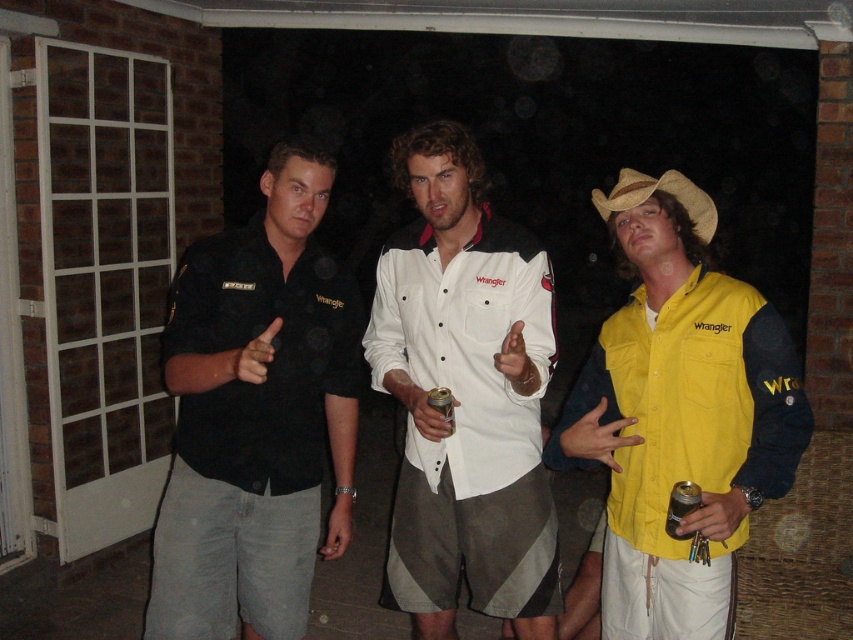
Who is shorter, strawhat at center or gold metallic can at center?

gold metallic can at center is shorter.

Is point (711, 227) positioned after point (428, 400)?

Yes, point (711, 227) is behind point (428, 400).

You are a GUI agent. You are given a task and a screenshot of the screen. Output one action in this format:
    pyautogui.click(x=<x>, y=<y>)
    Task: Click on the strawhat at center
    The height and width of the screenshot is (640, 853).
    Given the screenshot: What is the action you would take?
    pyautogui.click(x=662, y=192)

Looking at this image, which of these two, strawhat at center or metallic gold can at center, stands taller?

strawhat at center is taller.

Looking at this image, between strawhat at center and metallic gold can at center, which one is positioned lower?

metallic gold can at center

Locate an element on the screen. The image size is (853, 640). strawhat at center is located at coordinates (662, 192).

Does point (318, 193) come closer to viewer compared to point (496, 468)?

Yes.

Does black matte shirt at left have a greater height compared to white cotton shirt at center?

Incorrect, black matte shirt at left's height is not larger of white cotton shirt at center's.

Find the location of a particular element. black matte shirt at left is located at coordinates (256, 416).